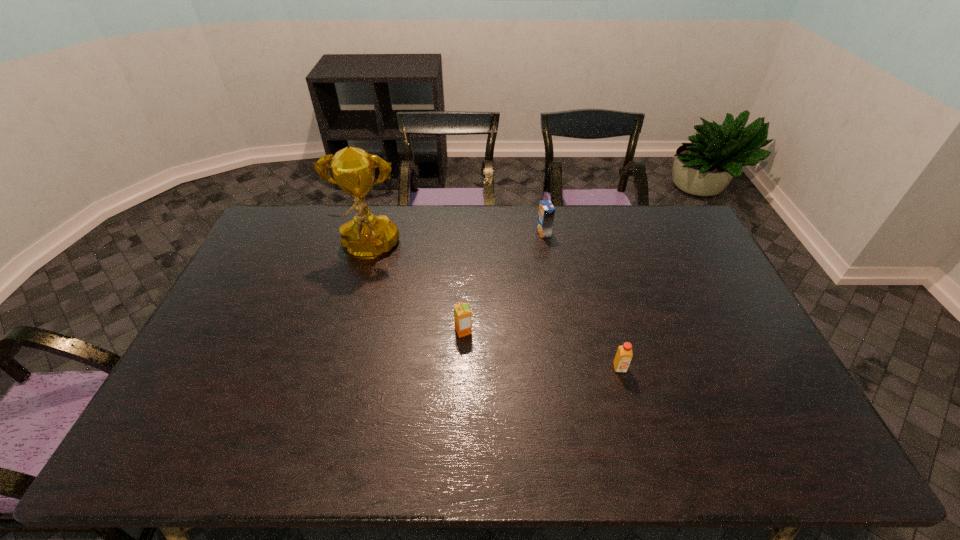
This screenshot has width=960, height=540. Identify the location of award. (x=366, y=236).

Locate an element on the screen. Image resolution: width=960 pixels, height=540 pixels. the tallest object is located at coordinates point(366,236).

Image resolution: width=960 pixels, height=540 pixels. Find the location of `the farthest orange juice`. the farthest orange juice is located at coordinates (546, 213).

You are a GUI agent. You are given a task and a screenshot of the screen. Output one action in this format:
    pyautogui.click(x=<x>, y=<y>)
    Task: Click on the second orange juice from right to left
    This screenshot has height=540, width=960.
    Given the screenshot: What is the action you would take?
    pyautogui.click(x=546, y=213)

Image resolution: width=960 pixels, height=540 pixels. I want to click on the second object from left to right, so click(x=462, y=314).

Find the location of a particular element. The height and width of the screenshot is (540, 960). the third farthest object is located at coordinates (462, 314).

Locate an element on the screen. The height and width of the screenshot is (540, 960). the nearest orange juice is located at coordinates [x=624, y=354].

Where is `the nearest object`? This screenshot has width=960, height=540. the nearest object is located at coordinates (624, 354).

This screenshot has height=540, width=960. In order to click on free space located on the front side of the leftmost object in this screenshot , I will do `click(340, 350)`.

Locate an element on the screen. vacant space situated 0.290m on the right of the farthest orange juice is located at coordinates (629, 232).